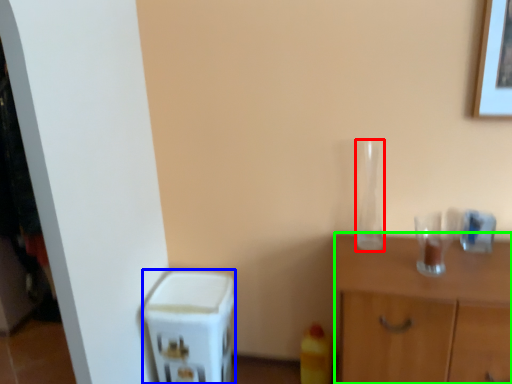
Question: Which object is the closest to the glass vase (highlighted by a red box)? Choose among these: appliance (highlighted by a blue box) or nightstand (highlighted by a green box).

Choices:
 (A) appliance
 (B) nightstand

Answer: (B)